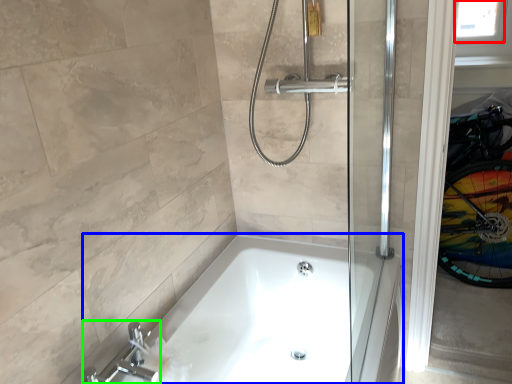
Question: Which object is the closest to the window screen (highlighted by a red box)? Choose among these: bathtub (highlighted by a blue box) or tap (highlighted by a green box).

Choices:
 (A) bathtub
 (B) tap

Answer: (A)